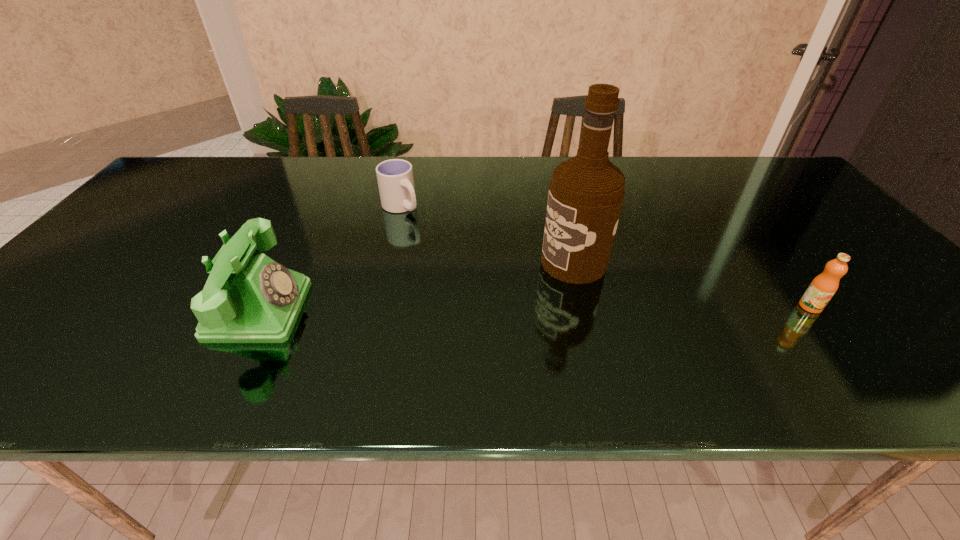
You are a GUI agent. You are given a task and a screenshot of the screen. Output one action in this format:
    pyautogui.click(x=<x>, y=<y>)
    Task: Click on the free space on the desktop that is between the leftmost object and the rightmost object and is positioned with the handle on the side of the farthest object
    
    Given the screenshot: What is the action you would take?
    tap(509, 308)

The width and height of the screenshot is (960, 540). Find the location of `free space on the desktop that is between the leftmost object and the orange juice and is positioned on the label of the tallest object`. free space on the desktop that is between the leftmost object and the orange juice and is positioned on the label of the tallest object is located at coordinates (468, 308).